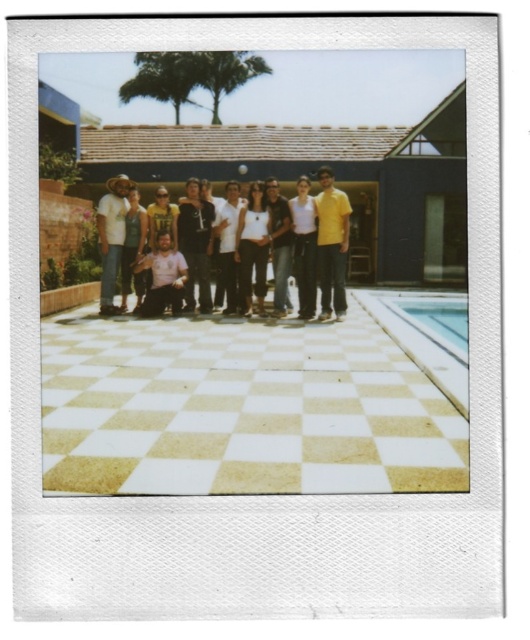
Does matte white shirt at left appear under dark brown leather jacket at center?

Incorrect, matte white shirt at left is not positioned below dark brown leather jacket at center.

Does point (101, 241) lie in front of point (288, 308)?

That is True.

Identify the location of matte white shirt at left. click(111, 236).

Measure the distance between yellow matte shirt at center and clear glass pool at lower right.

yellow matte shirt at center is 2.63 meters from clear glass pool at lower right.

Does yellow matte shirt at center appear on the right side of clear glass pool at lower right?

No, yellow matte shirt at center is not to the right of clear glass pool at lower right.

Describe the element at coordinates (331, 243) in the screenshot. I see `yellow matte shirt at center` at that location.

This screenshot has height=640, width=530. I want to click on yellow matte shirt at center, so click(331, 243).

Looking at this image, is yellow matte shirt at center smaller than white cotton shirt at center?

No.

Who is shorter, yellow matte shirt at center or white cotton shirt at center?

With less height is white cotton shirt at center.

The image size is (530, 640). Describe the element at coordinates (331, 243) in the screenshot. I see `yellow matte shirt at center` at that location.

Where is `yellow matte shirt at center`? yellow matte shirt at center is located at coordinates click(331, 243).